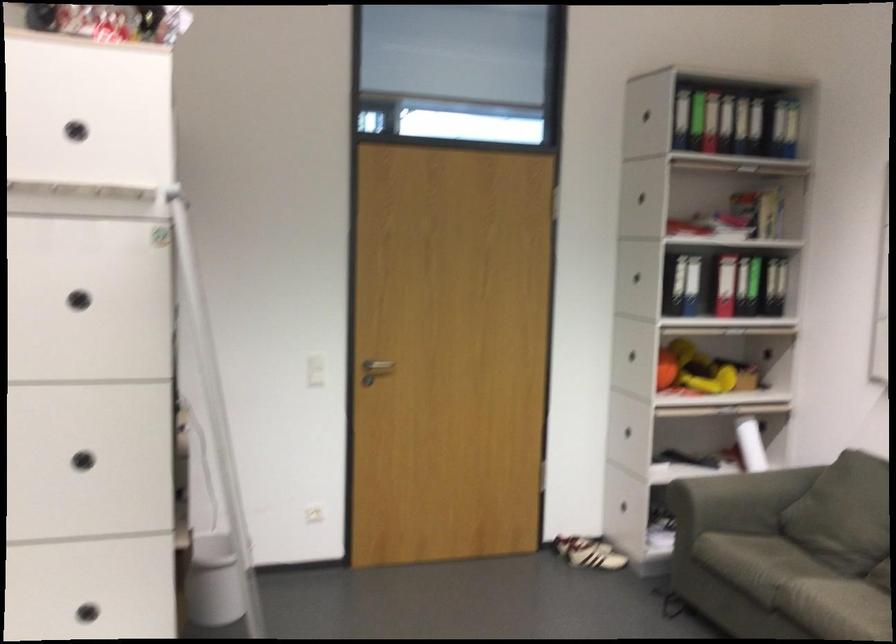
Where would you sit the sofa sitting surface? Please return your answer as a coordinate pair (x, y).

(832, 592)